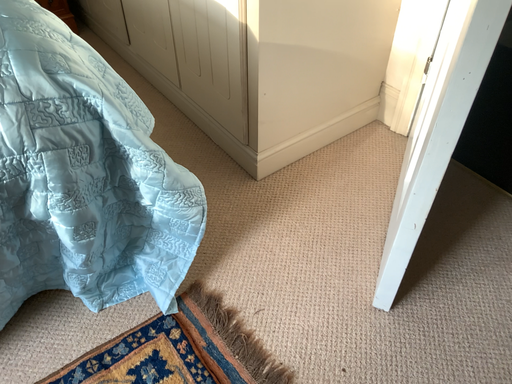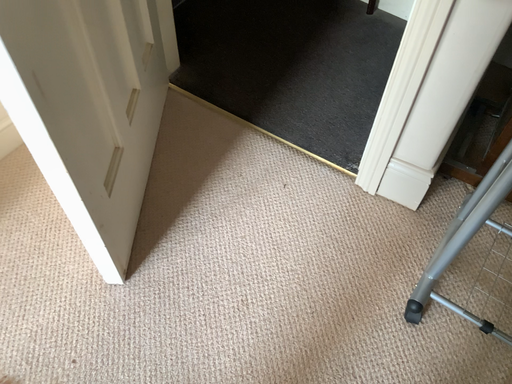
Question: Which way did the camera rotate in the video?

Choices:
 (A) rotated left
 (B) rotated right

Answer: (B)